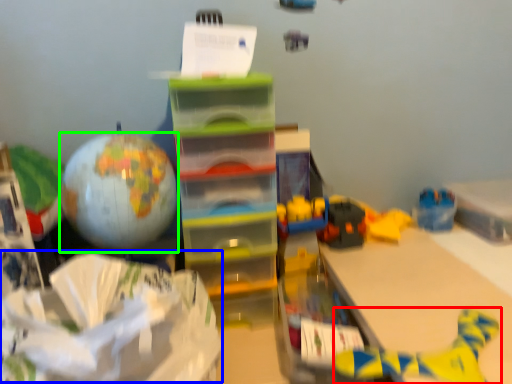
Question: Which object is the closest to the toy (highlighted by a red box)? Choose among these: wrapping paper (highlighted by a blue box) or balloon (highlighted by a green box).

Choices:
 (A) wrapping paper
 (B) balloon

Answer: (A)